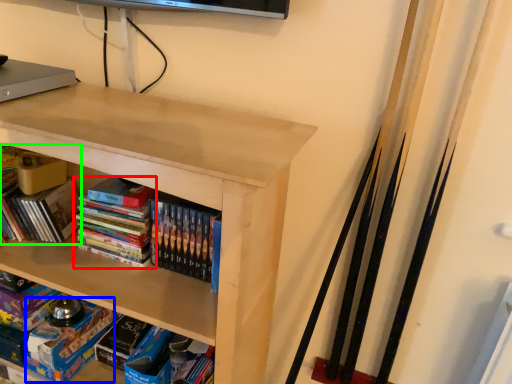
Question: Considering the real-world distances, which object is farthest from book (highlighted by a red box)? paperback book (highlighted by a blue box) or book (highlighted by a green box)?

Choices:
 (A) paperback book
 (B) book

Answer: (A)